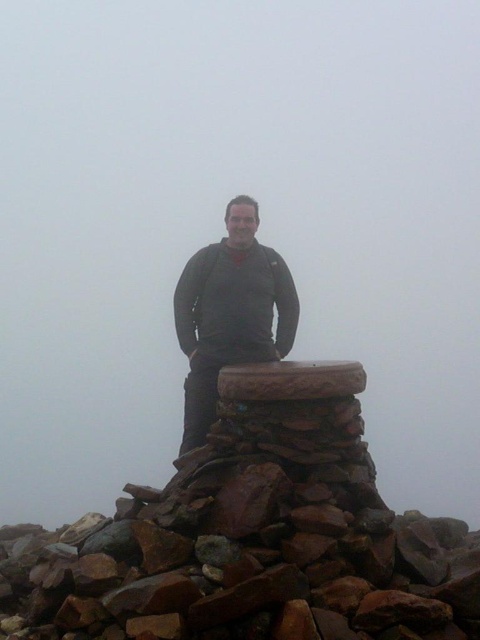
Question: Among these points, which one is nearest to the camera?

Choices:
 (A) (292, 486)
 (B) (194, 433)

Answer: (A)

Question: Where is brown rough stone at center located in relation to matte gray sweater at center in the image?

Choices:
 (A) above
 (B) below

Answer: (B)

Question: Can you confirm if brown rough stone at center is thinner than matte gray sweater at center?

Choices:
 (A) yes
 (B) no

Answer: (B)

Question: Does brown rough stone at center have a smaller size compared to matte gray sweater at center?

Choices:
 (A) yes
 (B) no

Answer: (B)